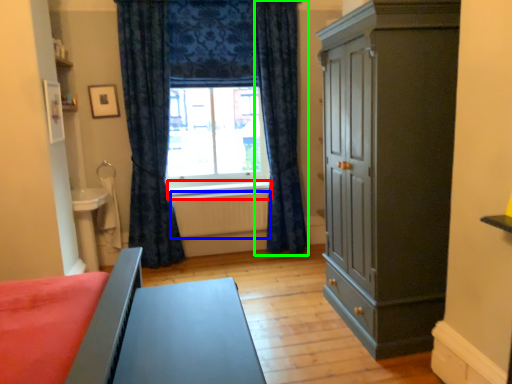
Question: Considering the real-world distances, which object is farthest from window sill (highlighted by a red box)? radiator (highlighted by a blue box) or curtain (highlighted by a green box)?

Choices:
 (A) radiator
 (B) curtain

Answer: (B)